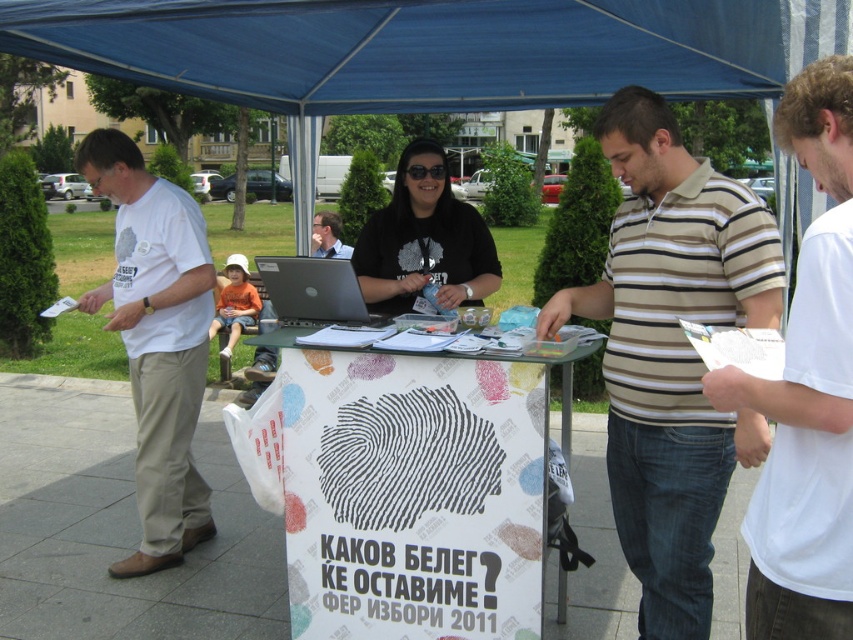
Question: Which of the following is the closest to the observer?

Choices:
 (A) (445, 582)
 (B) (349, 296)
 (C) (134, 384)

Answer: (A)

Question: Does striped polo shirt at center have a larger size compared to orange cotton shirt at center?

Choices:
 (A) no
 (B) yes

Answer: (B)

Question: Which object appears farthest from the camera in this image?

Choices:
 (A) silver metallic laptop at center
 (B) blue fabric canopy at upper center

Answer: (A)

Question: In this image, where is white cotton t-shirt at left located relative to matte black laptop at center?

Choices:
 (A) above
 (B) below

Answer: (B)

Question: Can you confirm if white cotton shirt at center is positioned to the left of silver metallic laptop at center?

Choices:
 (A) yes
 (B) no

Answer: (B)

Question: Among these points, which one is nearest to the camera?

Choices:
 (A) (352, 308)
 (B) (844, 202)

Answer: (B)